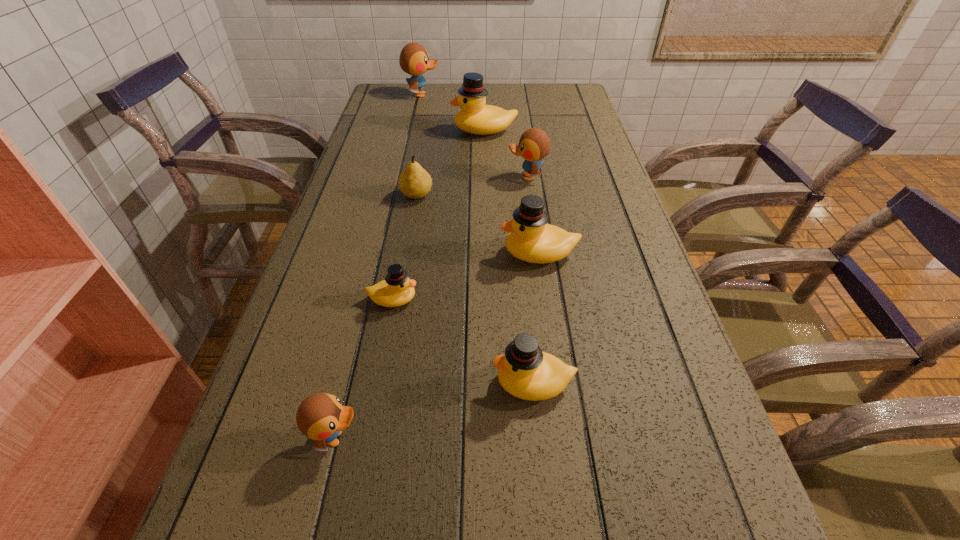
At what (x,y) coordinates should I click in order to perform the action: click on vacant region located 0.340m on the front-facing side of the second biggest yellow duck. Please return your answer as a coordinate pair (x, y). The height and width of the screenshot is (540, 960). Looking at the image, I should click on (353, 253).

Locate an element on the screen. The height and width of the screenshot is (540, 960). free spot located 0.100m on the front-facing side of the second biggest yellow duck is located at coordinates (457, 253).

At what (x,y) coordinates should I click in order to perform the action: click on free spot located 0.380m on the front-facing side of the second smallest blue duck. Please return your answer as a coordinate pair (x, y). The image size is (960, 540). Looking at the image, I should click on (373, 177).

Where is `blank space located 0.080m on the front-facing side of the second smallest blue duck`? This screenshot has height=540, width=960. blank space located 0.080m on the front-facing side of the second smallest blue duck is located at coordinates (479, 177).

At what (x,y) coordinates should I click in order to perform the action: click on vacant space located on the front-facing side of the second smallest blue duck. Please return your answer as a coordinate pair (x, y). The image size is (960, 540). Looking at the image, I should click on (454, 177).

This screenshot has width=960, height=540. I want to click on vacant area situated on the front of the fourth farthest object, so click(x=401, y=285).

Identify the location of free point located on the front-facing side of the nearest yellow duck. This screenshot has width=960, height=540. (437, 383).

You are a GUI agent. You are given a task and a screenshot of the screen. Output one action in this format:
    pyautogui.click(x=<x>, y=<y>)
    Task: Click on the vacant point located on the front-facing side of the nearest yellow duck
    
    Given the screenshot: What is the action you would take?
    pyautogui.click(x=431, y=383)

The image size is (960, 540). Identify the location of vacant space located 0.080m on the front-facing side of the nearest yellow duck. (447, 383).

Locate an element on the screen. The width and height of the screenshot is (960, 540). vacant region located on the front-facing side of the nearest blue duck is located at coordinates (562, 438).